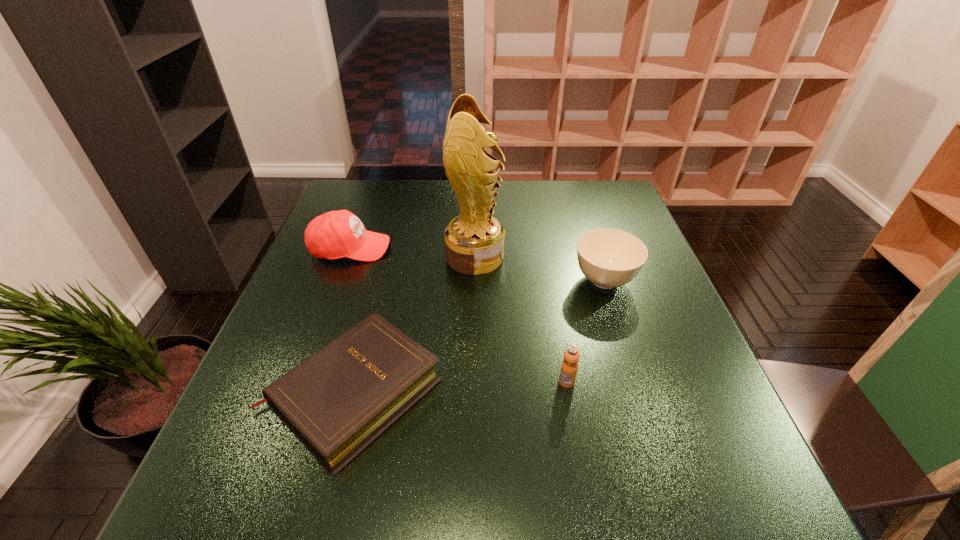
Find the location of `award`. award is located at coordinates (474, 240).

This screenshot has width=960, height=540. In order to click on baseball cap in this screenshot , I will do `click(336, 234)`.

Find the location of a particular element. the rightmost object is located at coordinates (609, 258).

Identify the location of the second object from right to left. Image resolution: width=960 pixels, height=540 pixels. (569, 367).

I want to click on Bible, so click(337, 401).

The height and width of the screenshot is (540, 960). I want to click on vacant space located 0.310m on the front-facing side of the tallest object, so click(x=619, y=256).

This screenshot has height=540, width=960. Identify the location of free location located on the front panel of the baseball cap. (507, 248).

You are a GUI agent. You are given a task and a screenshot of the screen. Output one action in this format:
    pyautogui.click(x=<x>, y=<y>)
    Task: Click on the vacant space located on the back of the sugar bowl
    The image size is (960, 540).
    Given the screenshot: What is the action you would take?
    pyautogui.click(x=576, y=192)

Where is `vacant space located 0.140m on the front label of the orange juice`? This screenshot has height=540, width=960. vacant space located 0.140m on the front label of the orange juice is located at coordinates (580, 457).

Where is `vacant area located 0.380m on the back of the Bible`? This screenshot has width=960, height=540. vacant area located 0.380m on the back of the Bible is located at coordinates (395, 231).